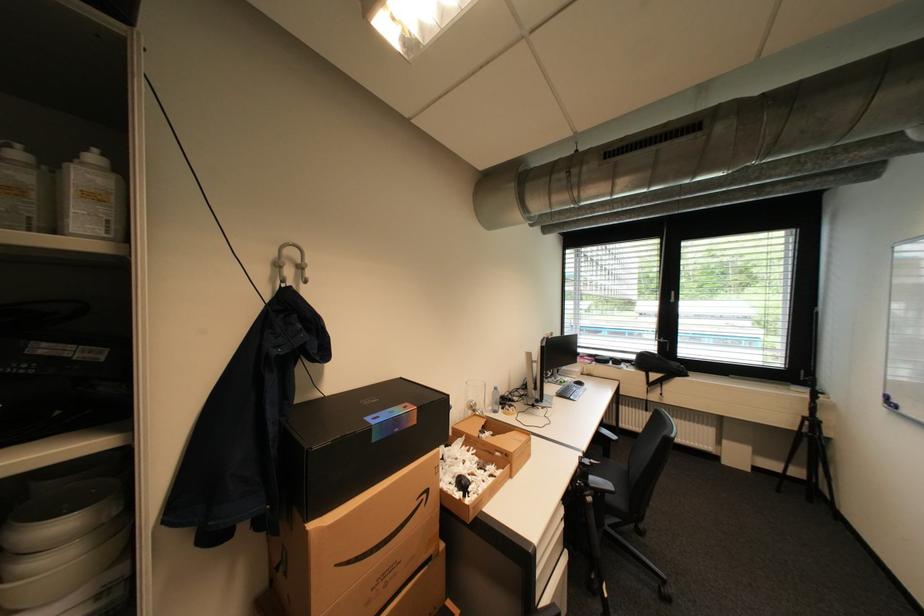
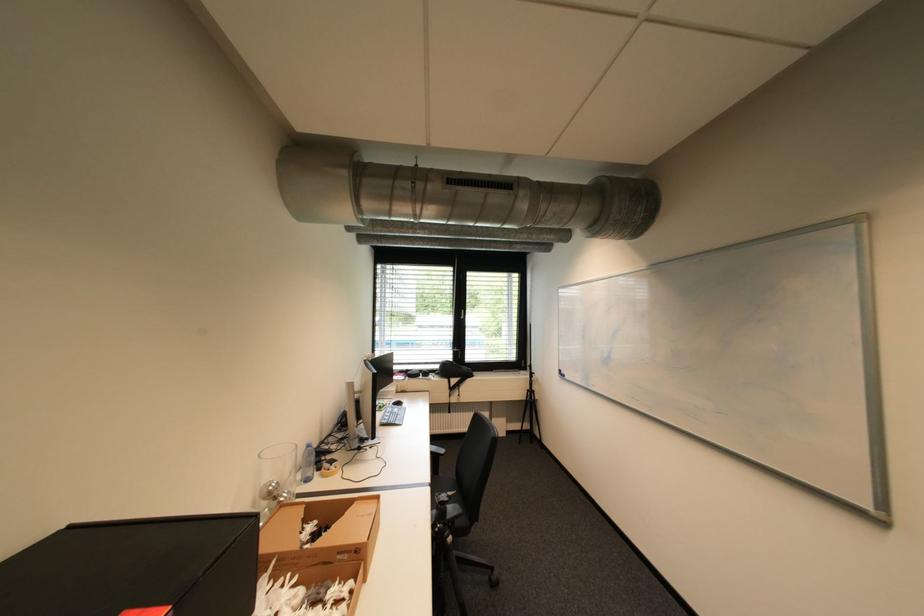
Where in the second image is the point corresponding to point 502,392 from the first image?

(313, 451)